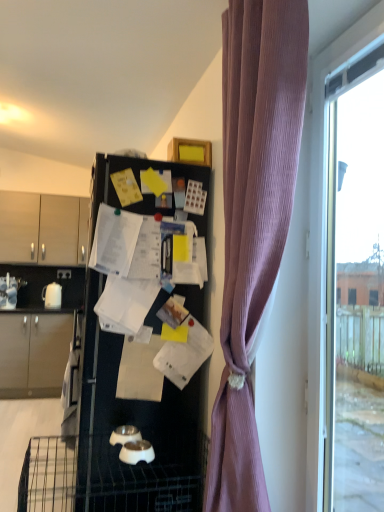
Question: Considering the relative positions of matte beige cabinet at left, arranged as the 2th cabinetry when viewed from the top, and white glossy kettle at left in the image provided, is matte beige cabinet at left, arranged as the 2th cabinetry when viewed from the top, to the left or to the right of white glossy kettle at left?

Choices:
 (A) right
 (B) left

Answer: (B)

Question: In terms of width, does matte beige cabinet at left, arranged as the 2th cabinetry when viewed from the top, look wider or thinner when compared to white glossy kettle at left?

Choices:
 (A) wide
 (B) thin

Answer: (A)

Question: Which of these objects is positioned closest to the matte wood cabinets at left, acting as the 2th cabinetry starting from the bottom?

Choices:
 (A) matte beige cabinet at left, positioned as the 1th cabinetry in bottom-to-top order
 (B) transparent glass window at right
 (C) purple ribbed curtain at right
 (D) black matte refrigerator at center
 (E) white glossy kettle at left

Answer: (E)

Question: Which object is positioned farthest from the matte beige cabinet at left, arranged as the 2th cabinetry when viewed from the top?

Choices:
 (A) transparent glass window at right
 (B) white glossy kettle at left
 (C) matte wood cabinets at left, placed as the 1th cabinetry when sorted from top to bottom
 (D) black matte refrigerator at center
 (E) purple ribbed curtain at right

Answer: (A)